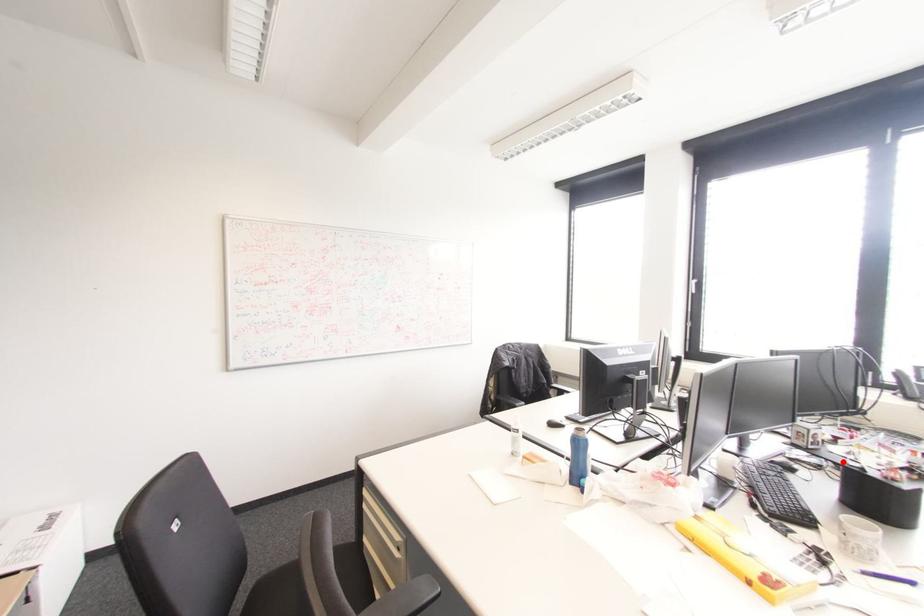
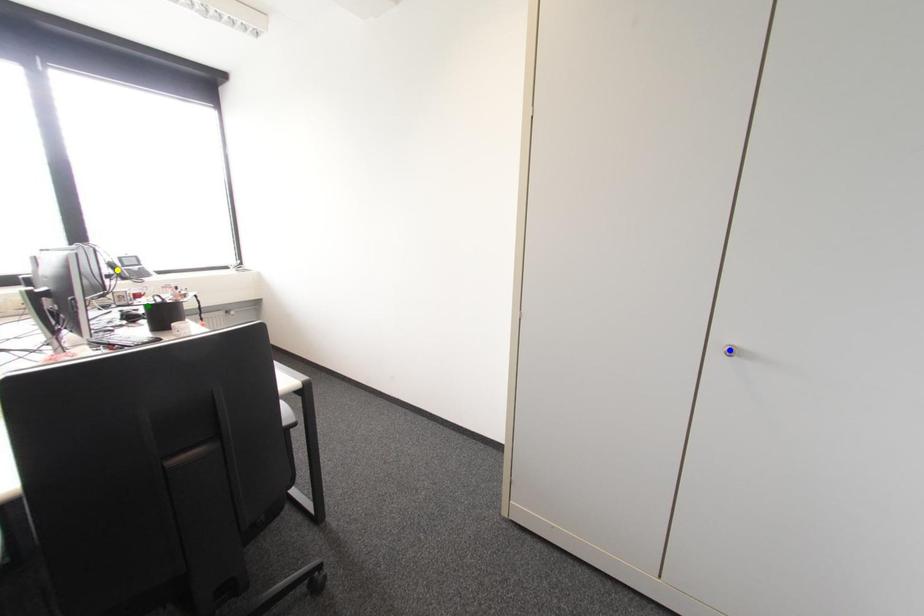
Question: I am providing you with two images of the same scene from different viewpoints. A red point is marked on the first image. You are given multiple points on the second image. In image 2, which mark is for the same physical point as the one in image 1?

Choices:
 (A) yellow point
 (B) blue point
 (C) green point

Answer: (C)